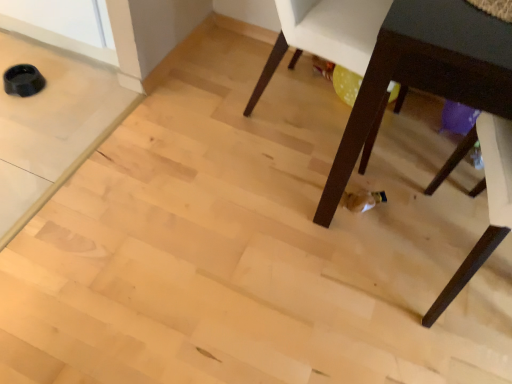
In order to click on vacant space that is in between dark wood chair at lower right, arranged as the 2th chair when viewed from the left, and dark wood table at lower right in this screenshot , I will do `click(380, 277)`.